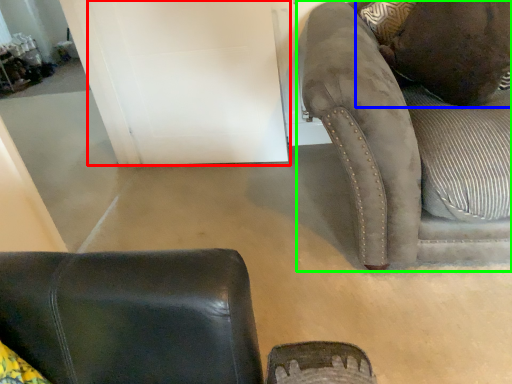
Question: Which object is the farthest from door (highlighted by a red box)? Choose among these: pillow (highlighted by a blue box) or studio couch (highlighted by a green box).

Choices:
 (A) pillow
 (B) studio couch

Answer: (A)